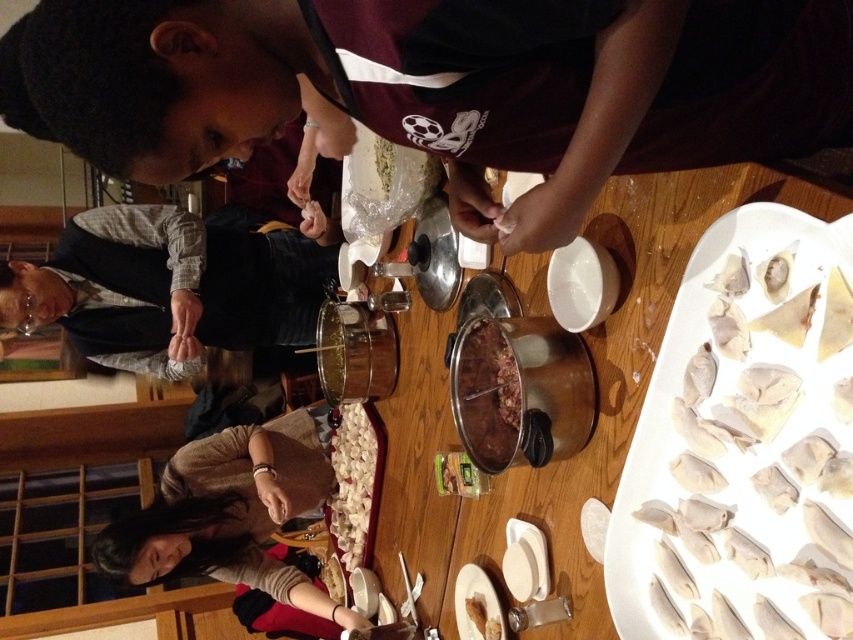
Question: Which of the following is the closest to the observer?

Choices:
 (A) (820, 624)
 (B) (293, 602)
 (C) (440, 8)

Answer: (C)

Question: Among these objects, which one is nearest to the camera?

Choices:
 (A) white matte plate at lower center
 (B) brown glossy meat at center
 (C) white matte dumplings at center
 (D) white paper platter at right

Answer: (D)

Question: Is gray fabric shirt at lower left positioned behind white paper plate at lower center?

Choices:
 (A) no
 (B) yes

Answer: (B)

Question: Is metallic silver pot at center positioned behind brown matte dumpling at lower center?

Choices:
 (A) yes
 (B) no

Answer: (B)

Question: Which point is farther from the camera taking this photo?

Choices:
 (A) pos(367,442)
 (B) pos(540,589)

Answer: (A)

Question: Is metallic silver pot at center thinner than white matte plate at lower center?

Choices:
 (A) no
 (B) yes

Answer: (A)